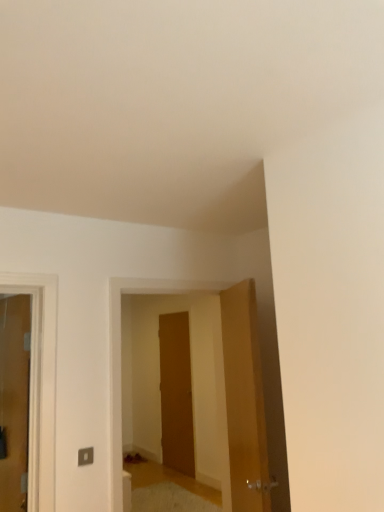
Question: Is wooden door at center situated inside wooden door at right, positioned as the 3th door in left-to-right order, or outside?

Choices:
 (A) inside
 (B) outside

Answer: (B)

Question: Relative to wooden door at right, arranged as the first door when viewed from the right, is wooden door at center in front or behind?

Choices:
 (A) front
 (B) behind

Answer: (B)

Question: Estimate the real-world distances between objects in this image. Which object is farther from the matte wooden door at left, positioned as the 1th door in left-to-right order?

Choices:
 (A) wooden door at right, positioned as the 3th door in left-to-right order
 (B) wooden door at center, positioned as the second door in left-to-right order
 (C) wooden door at center

Answer: (B)

Question: Which object is positioned closest to the wooden door at center, the 1th door positioned from the back?

Choices:
 (A) matte wooden door at left, positioned as the second door in front-to-back order
 (B) wooden door at right, the first door in the front-to-back sequence
 (C) wooden door at center

Answer: (C)